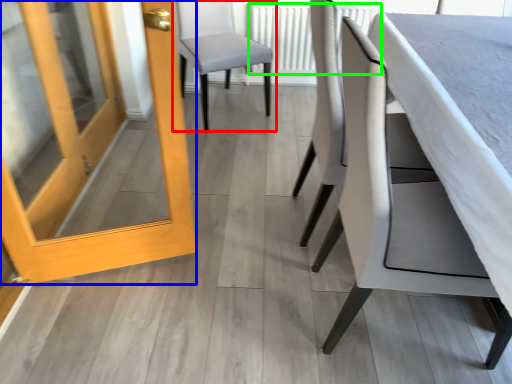
Question: Estimate the real-world distances between objects in this image. Which object is farther from chair (highlighted by a red box), door (highlighted by a blue box) or radiator (highlighted by a green box)?

Choices:
 (A) door
 (B) radiator

Answer: (A)